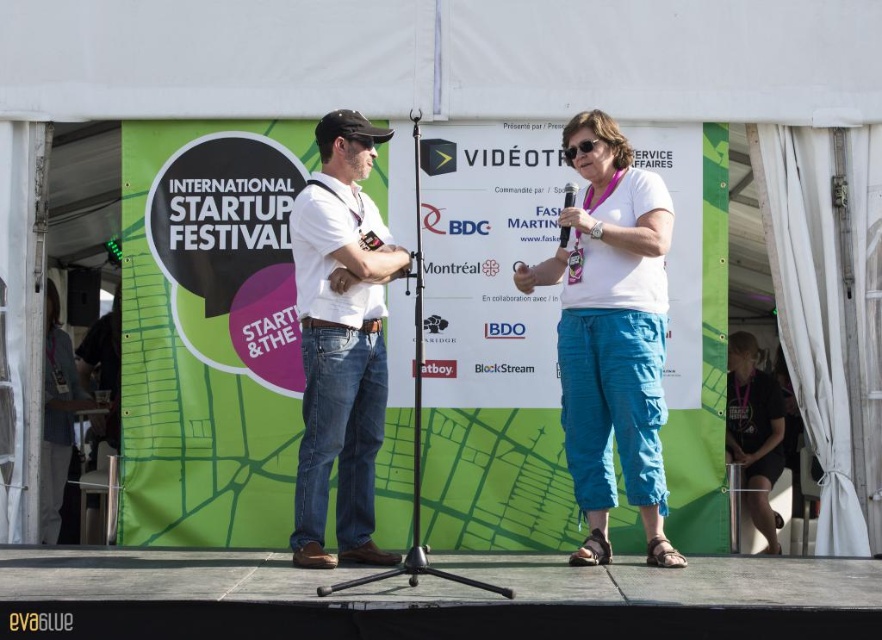
Question: Is the position of white cotton t-shirt at center more distant than that of black plastic microphone at center?

Choices:
 (A) no
 (B) yes

Answer: (A)

Question: Which object is the farthest from the white cotton t-shirt at center?

Choices:
 (A) black plastic microphone at center
 (B) black fabric at lower right

Answer: (B)

Question: Which point is farther from the camera taking this photo?

Choices:
 (A) (566, 204)
 (B) (623, 400)
 (C) (756, 378)

Answer: (C)

Question: Estimate the real-world distances between objects in this image. Which object is farther from the white cotton shirt at center?

Choices:
 (A) white cotton t-shirt at center
 (B) black fabric at lower right

Answer: (B)

Question: Is white cotton t-shirt at center positioned in front of black plastic microphone at center?

Choices:
 (A) no
 (B) yes

Answer: (B)

Question: Does white cotton t-shirt at center lie in front of black plastic microphone at center?

Choices:
 (A) yes
 (B) no

Answer: (A)